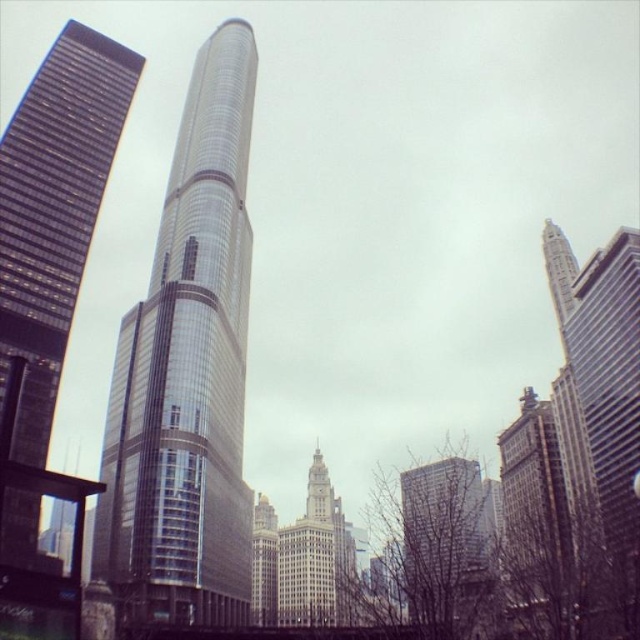
Who is more distant from viewer, (170, 244) or (548, 525)?

Positioned behind is point (548, 525).

Is shiny glass skyscraper at center to the left of brick building at center from the viewer's perspective?

Yes, shiny glass skyscraper at center is to the left of brick building at center.

What are the coordinates of `shiny glass skyscraper at center` in the screenshot? It's located at (188, 372).

Which of these two, glassy reflective skyscraper at left or brick building at center, stands shorter?

brick building at center

Is point (109, 90) positioned after point (522, 582)?

Yes, point (109, 90) is behind point (522, 582).

Does point (99, 189) lie behind point (547, 618)?

Yes, it is behind point (547, 618).

Find the location of a particular element. glassy reflective skyscraper at left is located at coordinates (54, 211).

Is shiny glass skyscraper at center to the right of metallic glass skyscraper at center from the viewer's perspective?

No, shiny glass skyscraper at center is not to the right of metallic glass skyscraper at center.

Is shiny glass skyscraper at center taller than metallic glass skyscraper at center?

Yes, shiny glass skyscraper at center is taller than metallic glass skyscraper at center.

Does point (129, 339) lie in front of point (412, 589)?

No, it is not.

Find the location of a particular element. The height and width of the screenshot is (640, 640). shiny glass skyscraper at center is located at coordinates (188, 372).